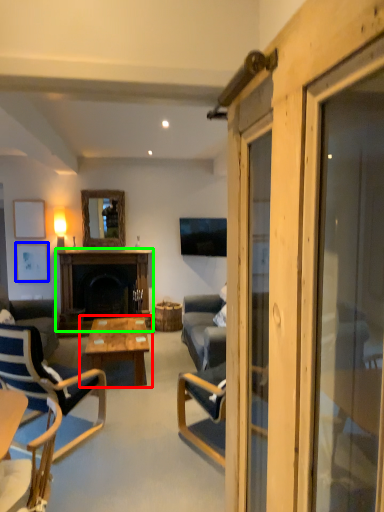
Question: Which is nearer to the coffee table (highlighted by a red box)? picture frame (highlighted by a blue box) or fireplace (highlighted by a green box).

Choices:
 (A) picture frame
 (B) fireplace

Answer: (B)